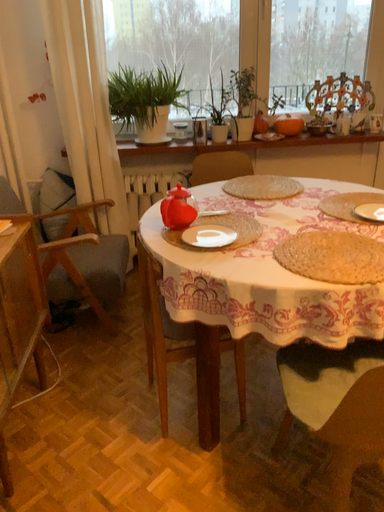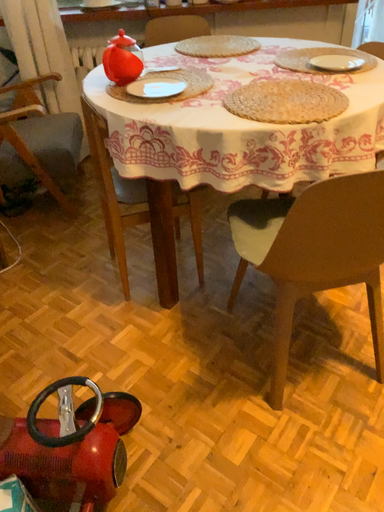
Question: How did the camera likely rotate when shooting the video?

Choices:
 (A) rotated downward
 (B) rotated upward

Answer: (A)